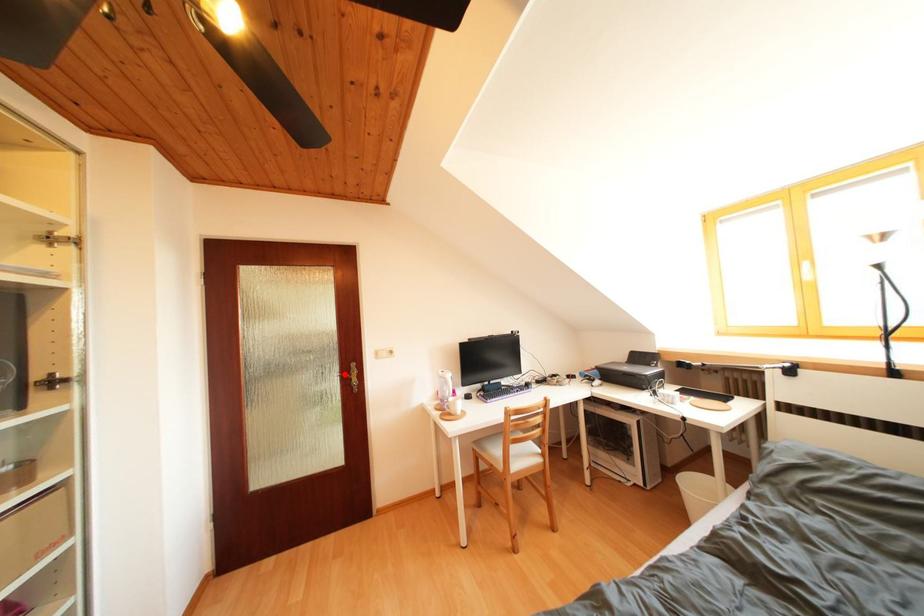
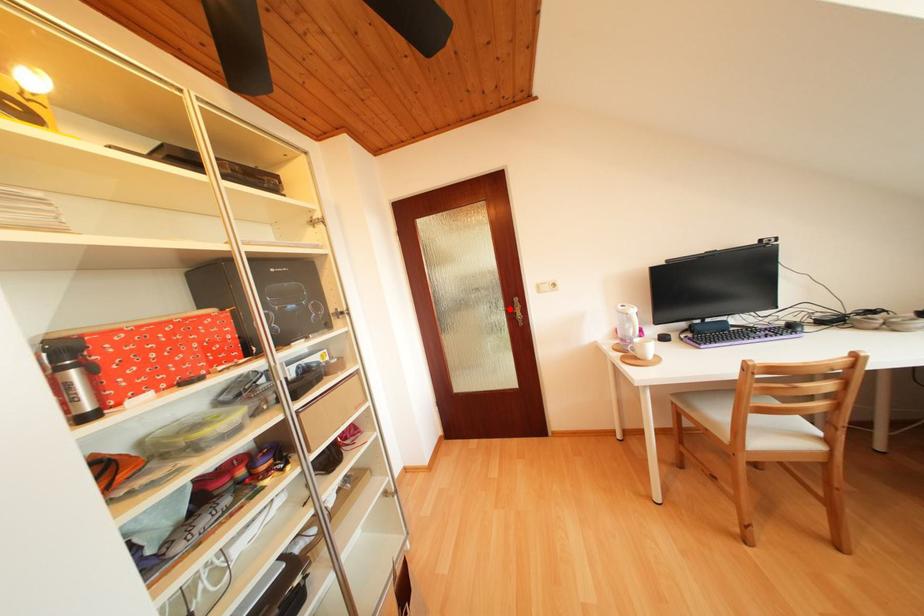
I am providing you with two images of the same scene from different viewpoints. A red point is marked on the first image and another point is marked on the second image. Do the highlighted points in image1 and image2 indicate the same real-world spot?

Yes